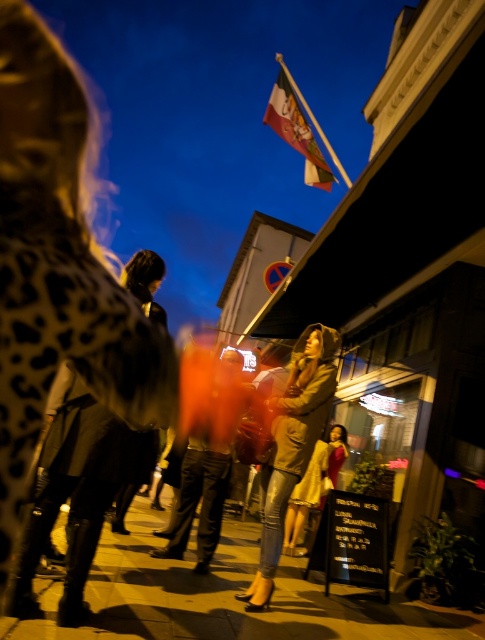
From the picture: You are a photographer who wants to capture a clear shot of both the leopard print coat at center and the leather jacket at center. Since the scene has a shallow depth of field, which item should you focus on to ensure it appears sharp?

The leopard print coat at center is located above the leather jacket at center, so focusing on the leopard print coat at center will ensure it appears sharp due to its position in the shallow depth of field.

You are a photographer who wants to capture a clear shot of the leopard print coat at center and the leather jacket at center. Since the subjects are moving, you need to adjust your focus. Which object should you focus on first to ensure it appears sharp in the photo?

The leopard print coat at center is in front of the leather jacket at center, so you should focus on the leopard print coat at center first to ensure it appears sharp.